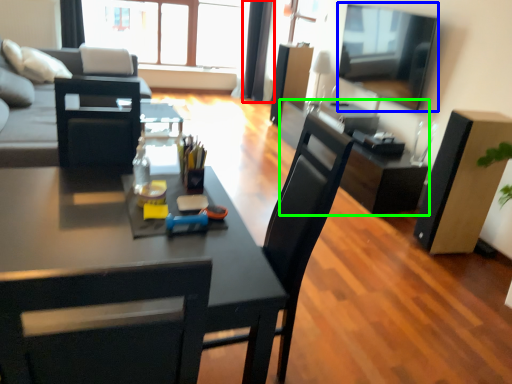
Question: Which is farther away from curtain (highlighted by a red box)? television (highlighted by a blue box) or computer desk (highlighted by a green box)?

Choices:
 (A) television
 (B) computer desk

Answer: (B)